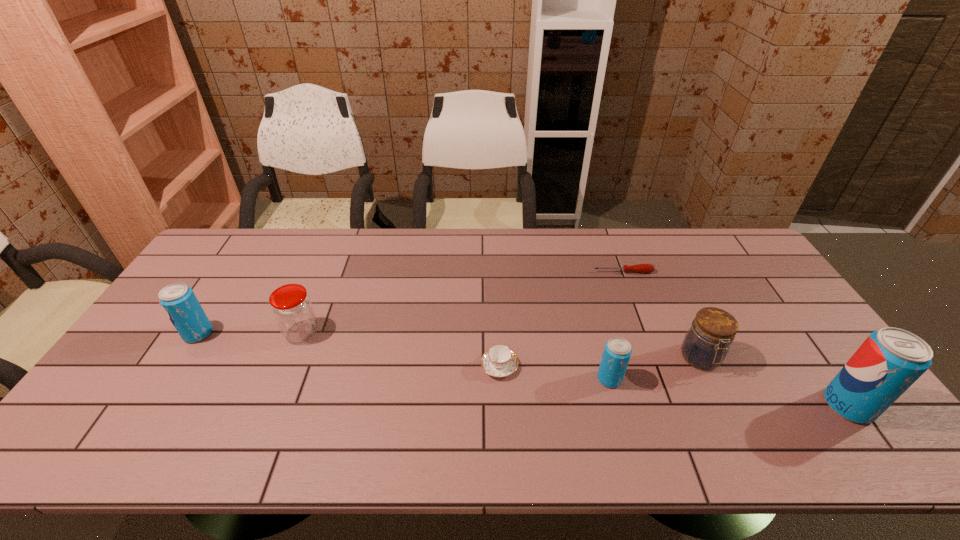
Locate which soda can ranks in proximity to the rightmost object. Please provide its 2D coordinates. Your answer should be formatted as a tuple, i.e. [(x, y)], where the tuple contains the x and y coordinates of a point satisfying the conditions above.

[(617, 351)]

You are a GUI agent. You are given a task and a screenshot of the screen. Output one action in this format:
    pyautogui.click(x=<x>, y=<y>)
    Task: Click on the second closest soda can to the left jar
    The width and height of the screenshot is (960, 540).
    Given the screenshot: What is the action you would take?
    (x=617, y=351)

This screenshot has height=540, width=960. Find the location of `vacant space that satisfies the following two spatial constraints: 1. on the lid of the right jar; 2. on the side with the handle of the teacup`. vacant space that satisfies the following two spatial constraints: 1. on the lid of the right jar; 2. on the side with the handle of the teacup is located at coordinates (704, 366).

At what (x,y) coordinates should I click in order to perform the action: click on vacant area that satisfies the following two spatial constraints: 1. on the front side of the shortest soda can; 2. on the right side of the leftmost object. Please return your answer as a coordinate pair (x, y). This screenshot has width=960, height=540. Looking at the image, I should click on (169, 379).

Where is `free point that satisfies the following two spatial constraints: 1. on the lid of the right jar; 2. on the side with the handle of the third object from left to right`? The height and width of the screenshot is (540, 960). free point that satisfies the following two spatial constraints: 1. on the lid of the right jar; 2. on the side with the handle of the third object from left to right is located at coordinates (704, 366).

This screenshot has width=960, height=540. In order to click on free space that satisfies the following two spatial constraints: 1. on the side with the handle of the fifth object from right to left; 2. on the back side of the fourth object from right to left in this screenshot , I will do `click(500, 379)`.

Image resolution: width=960 pixels, height=540 pixels. Identify the location of free spot that satisfies the following two spatial constraints: 1. on the back side of the shortest object; 2. on the right side of the fourth object from left to right. (581, 272).

The width and height of the screenshot is (960, 540). In order to click on vacant region that satisfies the following two spatial constraints: 1. on the side with the handle of the teacup; 2. on the back side of the rightmost object in this screenshot , I will do `click(501, 405)`.

The image size is (960, 540). Find the location of `vacant space that satisfies the following two spatial constraints: 1. on the side with the handle of the teacup; 2. on the back side of the tallest object`. vacant space that satisfies the following two spatial constraints: 1. on the side with the handle of the teacup; 2. on the back side of the tallest object is located at coordinates (501, 405).

This screenshot has height=540, width=960. Identify the location of vacant point that satisfies the following two spatial constraints: 1. on the front side of the second object from left to right; 2. on the right side of the fourth object from left to right. (283, 379).